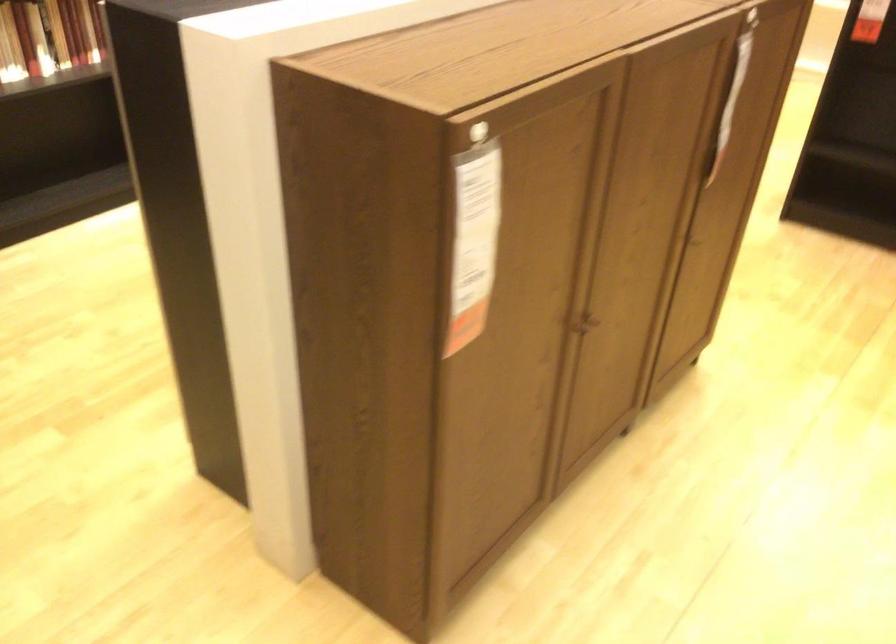
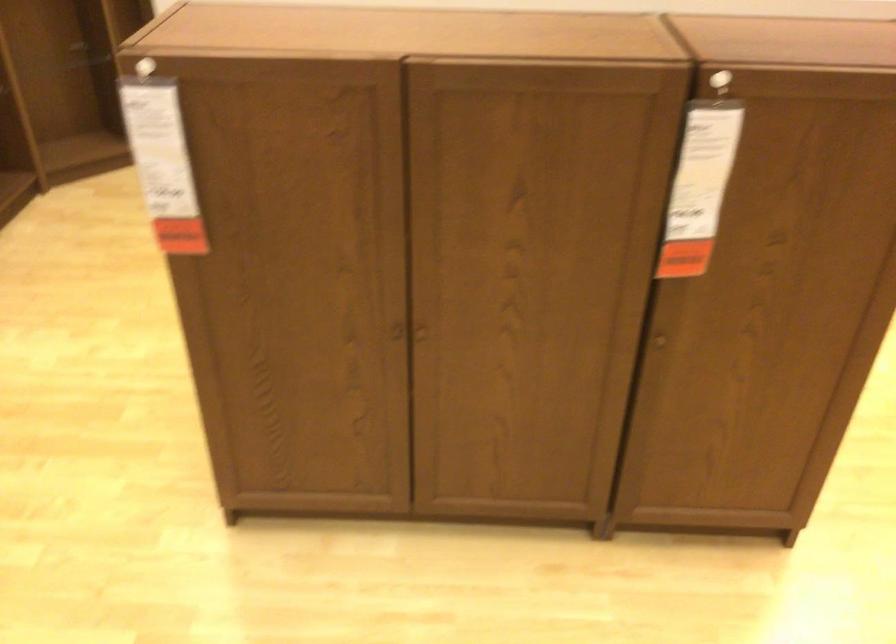
In the second image, find the point that corresponds to pixel 464 142 in the first image.

(143, 67)